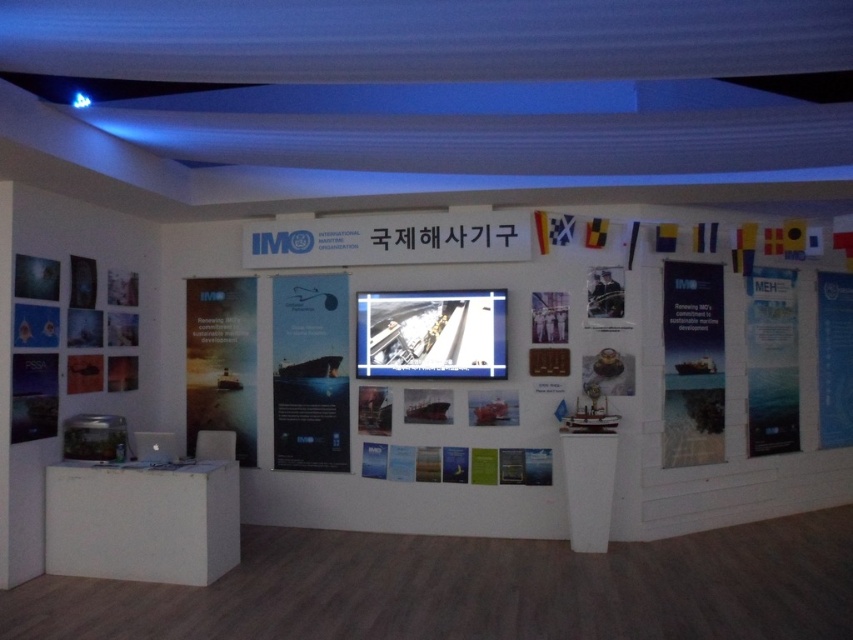
Is point (277, 294) less distant than point (764, 403)?

Yes, it is in front of point (764, 403).

The image size is (853, 640). Describe the element at coordinates (310, 372) in the screenshot. I see `matte paper poster at center` at that location.

At what (x,y) coordinates should I click in order to perform the action: click on matte paper poster at center. Please return your answer as a coordinate pair (x, y). The image size is (853, 640). Looking at the image, I should click on (310, 372).

The image size is (853, 640). What do you see at coordinates (770, 362) in the screenshot?
I see `blue paper poster at right` at bounding box center [770, 362].

Which is more to the left, blue paper poster at right or blue paper at upper right?

Positioned to the left is blue paper poster at right.

Between point (785, 365) and point (836, 385), which one is positioned behind?

Positioned behind is point (836, 385).

The width and height of the screenshot is (853, 640). Find the location of `blue paper poster at right`. blue paper poster at right is located at coordinates (770, 362).

Does blue paper poster at center have a larger size compared to blue paper poster at right?

Incorrect, blue paper poster at center is not larger than blue paper poster at right.

Is blue paper poster at center positioned in front of blue paper poster at right?

Yes, blue paper poster at center is closer to the viewer.

Which is in front, point (677, 301) or point (776, 323)?

Point (677, 301) is more forward.

Identify the location of blue paper poster at center. (692, 364).